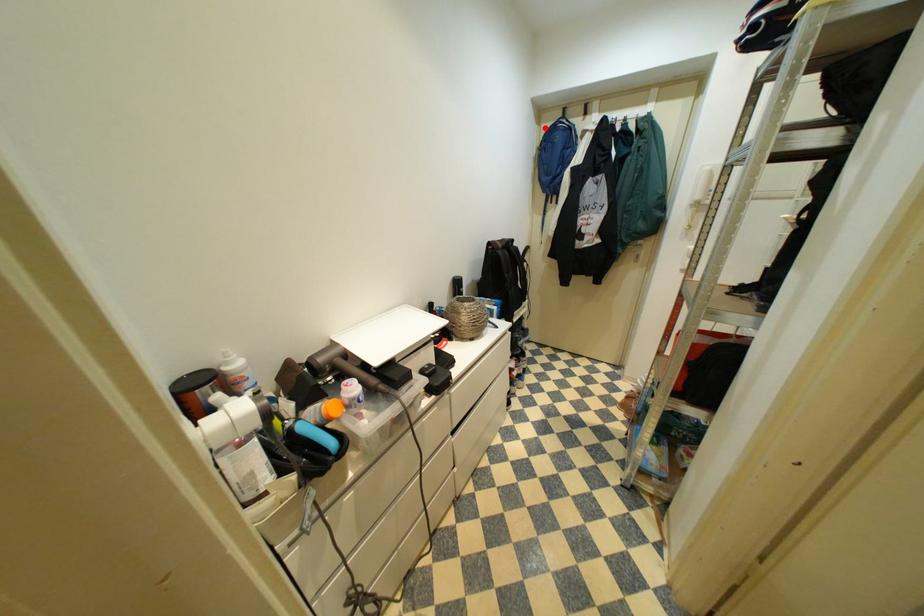
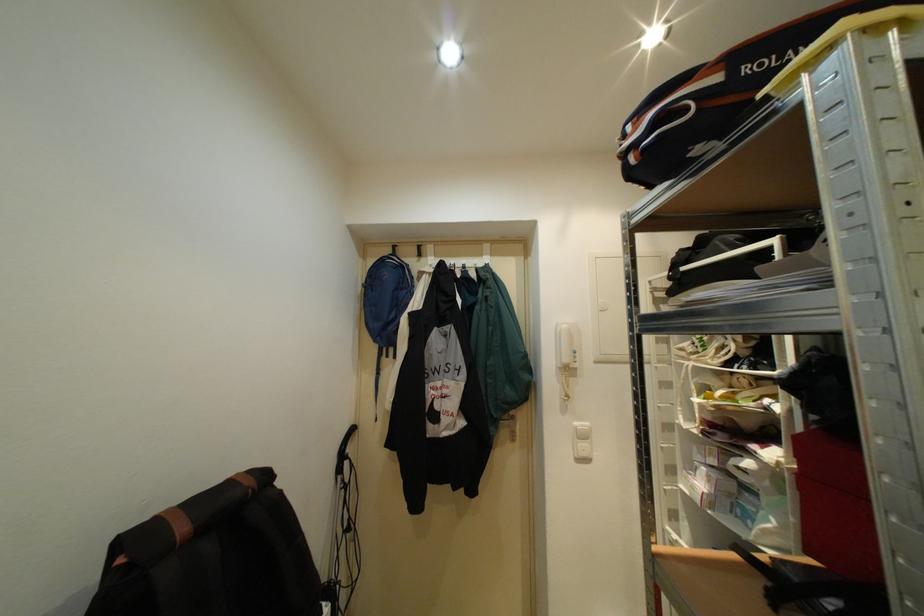
Question: I am providing you with two images of the same scene from different viewpoints. A red point is marked on the first image. Can you still see the location of the red point in image 2?

Choices:
 (A) Yes
 (B) No

Answer: (A)